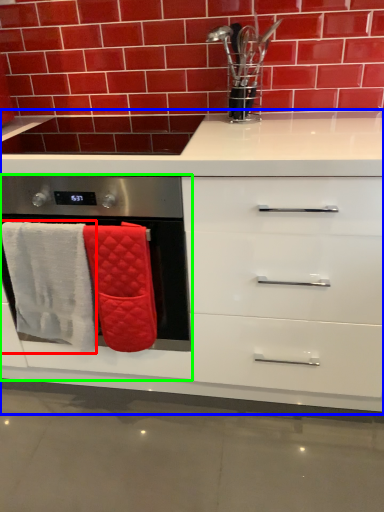
Question: Which object is positioned closest to bath towel (highlighted by a red box)? Select from cabinetry (highlighted by a blue box) and oven (highlighted by a green box).

Choices:
 (A) cabinetry
 (B) oven

Answer: (B)